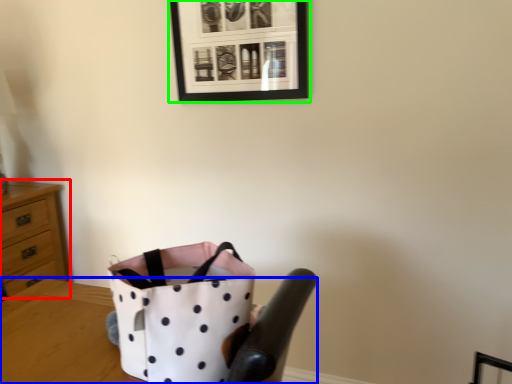
Question: Considering the real-world distances, which object is closest to chest of drawers (highlighted by a red box)? table (highlighted by a blue box) or picture frame (highlighted by a green box).

Choices:
 (A) table
 (B) picture frame

Answer: (A)